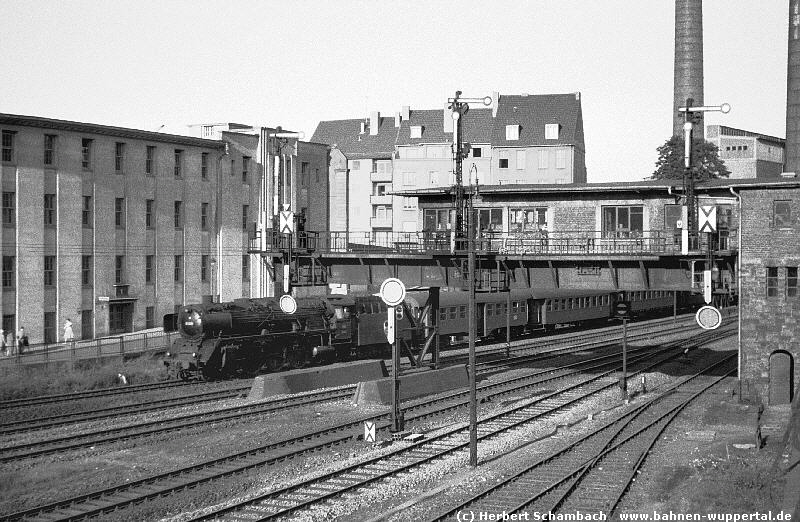
This screenshot has height=522, width=800. Find the location of `chimney`. chimney is located at coordinates (686, 93).